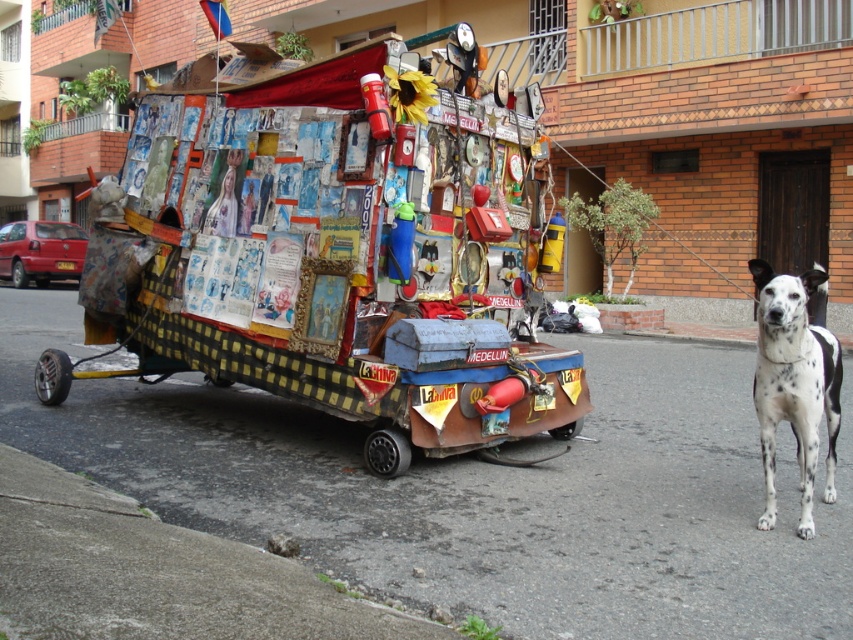
What do you see at coordinates (332, 260) in the screenshot? The image size is (853, 640). I see `decorative cardboard cart at center` at bounding box center [332, 260].

Can you confirm if decorative cardboard cart at center is positioned above white-spotted fur dog at right?

Indeed, decorative cardboard cart at center is positioned over white-spotted fur dog at right.

The height and width of the screenshot is (640, 853). Identify the location of decorative cardboard cart at center. (332, 260).

Locate an element on the screen. The image size is (853, 640). decorative cardboard cart at center is located at coordinates (332, 260).